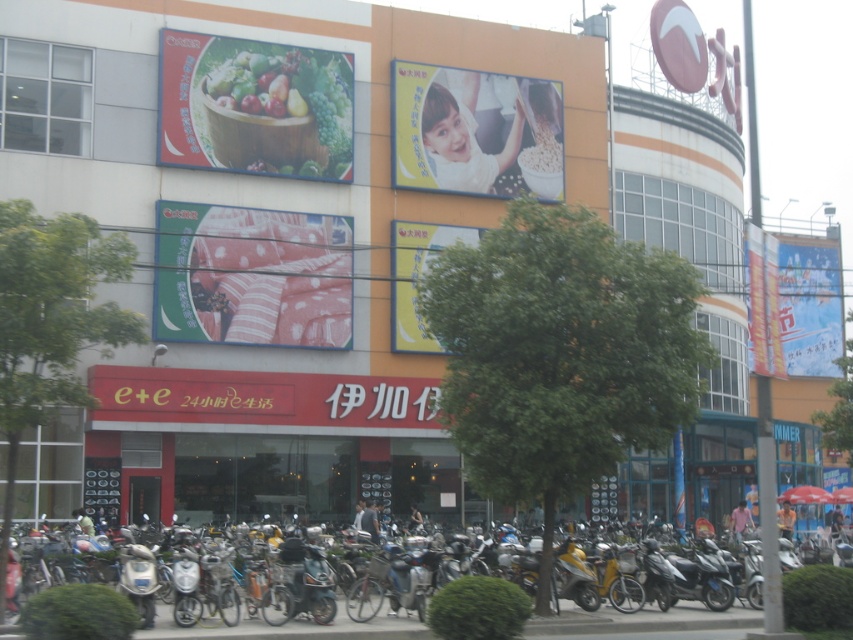
Looking at this image, between silver metallic scooter at center and orange fabric umbrella at lower right, which one has less height?

With less height is silver metallic scooter at center.

Can you confirm if silver metallic scooter at center is shorter than orange fabric umbrella at lower right?

Yes, silver metallic scooter at center is shorter than orange fabric umbrella at lower right.

Find the location of `silver metallic scooter at center`. silver metallic scooter at center is located at coordinates (691, 577).

Does yellow matte scooter at center come behind light blue shirt at center?

That is False.

Does yellow matte scooter at center have a greater height compared to light blue shirt at center?

Indeed, yellow matte scooter at center has a greater height compared to light blue shirt at center.

I want to click on yellow matte scooter at center, so click(573, 577).

The image size is (853, 640). Find the location of `yellow matte scooter at center`. yellow matte scooter at center is located at coordinates (573, 577).

Between yellow matte scooter at center and silver metallic scooter at center, which one appears on the right side from the viewer's perspective?

silver metallic scooter at center is more to the right.

Is yellow matte scooter at center thinner than silver metallic scooter at center?

In fact, yellow matte scooter at center might be wider than silver metallic scooter at center.

From the picture: Who is more forward, (x=577, y=592) or (x=715, y=572)?

Point (x=577, y=592) is in front.

In order to click on yellow matte scooter at center in this screenshot , I will do pyautogui.click(x=573, y=577).